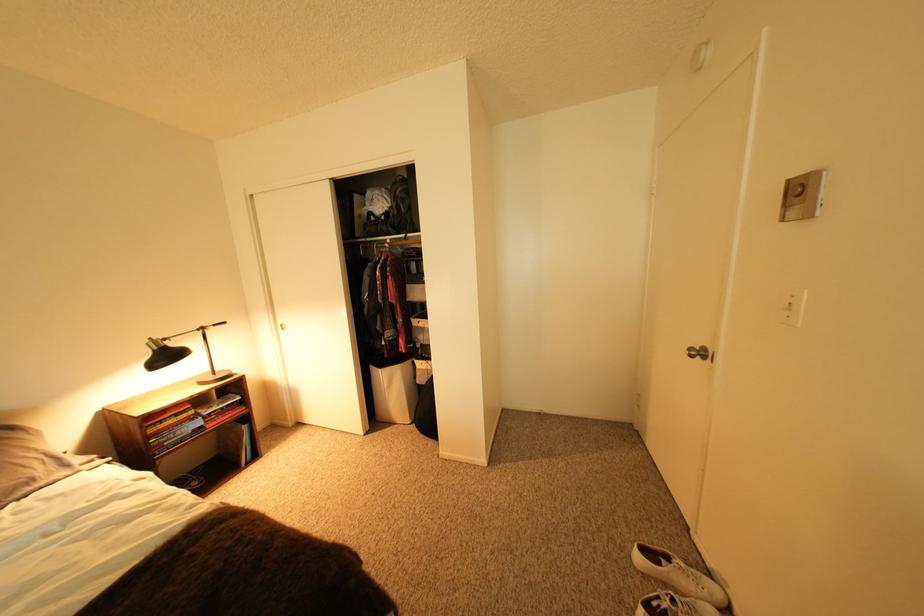
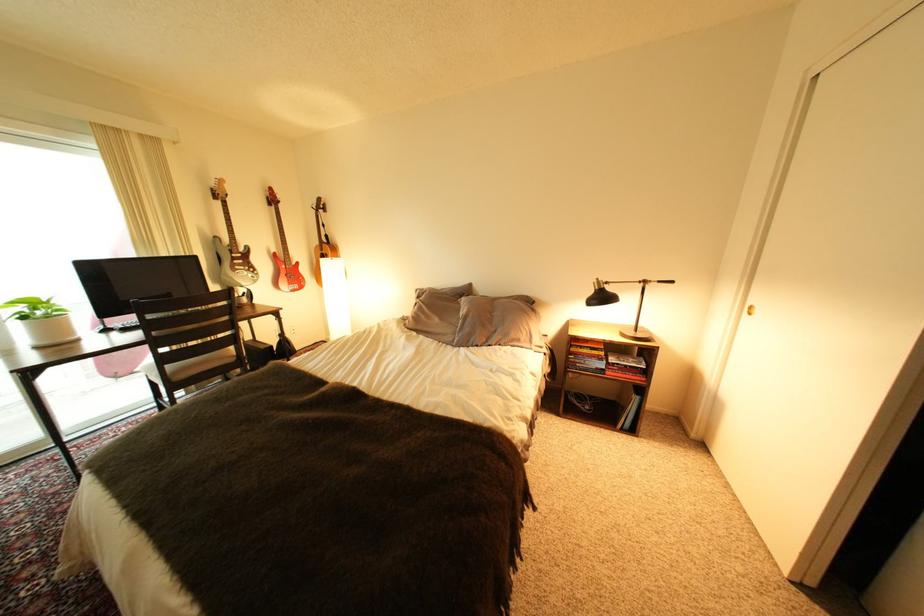
Where in the second image is the point corresponding to (175,365) from the first image?

(608, 304)